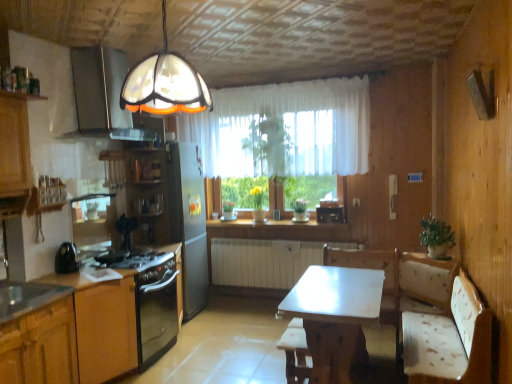
Question: From a real-world perspective, is matte glass exhaust hood at upper left on top of metallic stainless steel sink at lower left?

Choices:
 (A) yes
 (B) no

Answer: (A)

Question: Is matte glass exhaust hood at upper left not inside metallic stainless steel sink at lower left?

Choices:
 (A) no
 (B) yes

Answer: (B)

Question: Is matte glass exhaust hood at upper left smaller than metallic stainless steel sink at lower left?

Choices:
 (A) no
 (B) yes

Answer: (A)

Question: From the image's perspective, is matte glass exhaust hood at upper left located above metallic stainless steel sink at lower left?

Choices:
 (A) yes
 (B) no

Answer: (A)

Question: Is matte glass exhaust hood at upper left to the right of metallic stainless steel sink at lower left from the viewer's perspective?

Choices:
 (A) no
 (B) yes

Answer: (B)

Question: Is matte glass exhaust hood at upper left positioned with its back to metallic stainless steel sink at lower left?

Choices:
 (A) no
 (B) yes

Answer: (A)

Question: Is matte glass exhaust hood at upper left positioned far away from white sheer curtain at center?

Choices:
 (A) yes
 (B) no

Answer: (A)

Question: From a real-world perspective, does matte glass exhaust hood at upper left sit lower than white sheer curtain at center?

Choices:
 (A) no
 (B) yes

Answer: (A)

Question: From the image's perspective, is matte glass exhaust hood at upper left over white sheer curtain at center?

Choices:
 (A) yes
 (B) no

Answer: (A)

Question: Could you tell me if matte glass exhaust hood at upper left is facing white sheer curtain at center?

Choices:
 (A) no
 (B) yes

Answer: (A)

Question: Is matte glass exhaust hood at upper left turned away from white sheer curtain at center?

Choices:
 (A) yes
 (B) no

Answer: (B)

Question: Does matte glass exhaust hood at upper left appear on the left side of white sheer curtain at center?

Choices:
 (A) no
 (B) yes

Answer: (B)

Question: Is the depth of black glossy kettle at left less than that of metallic stainless steel sink at lower left?

Choices:
 (A) no
 (B) yes

Answer: (A)